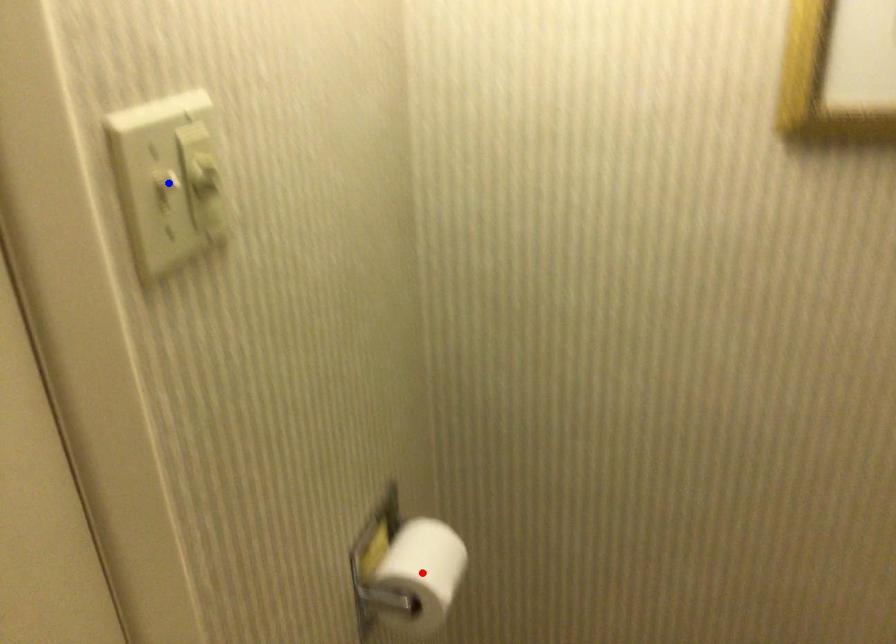
Question: Which of the two points in the image is closer to the camera?

Choices:
 (A) Blue point is closer.
 (B) Red point is closer.

Answer: (A)